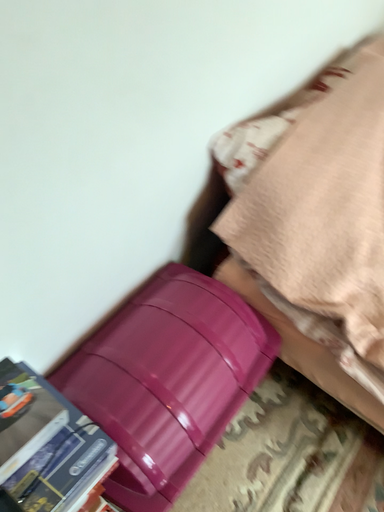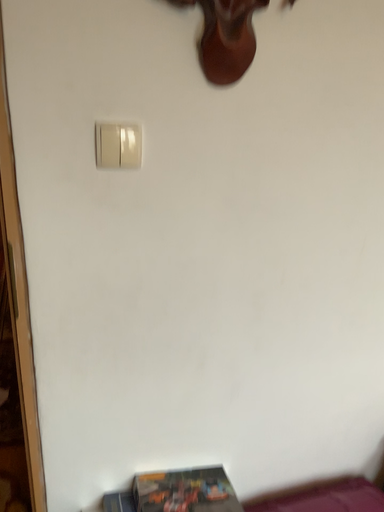
Question: How did the camera likely rotate when shooting the video?

Choices:
 (A) rotated downward
 (B) rotated upward

Answer: (B)